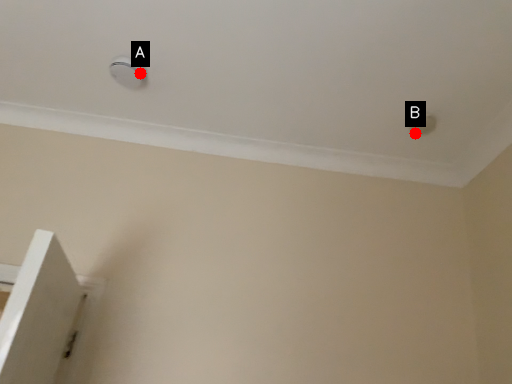
Question: Two points are circled on the image, labeled by A and B beside each circle. Which point is farther from the camera taking this photo?

Choices:
 (A) A is further
 (B) B is further

Answer: (B)